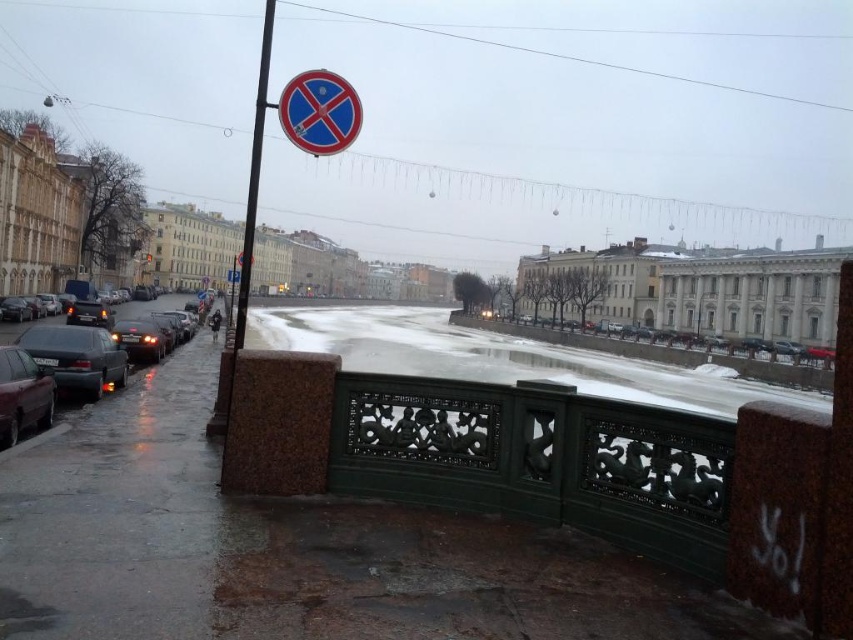
Based on the photo, you are a pedestrian standing on the bridge and want to take a photo of the matte black car at left and the polished metal pole at upper left. Which object should you focus on first to ensure both are in the frame?

The matte black car at left is closer to you than the polished metal pole at upper left, so focus on the matte black car at left first to ensure both are in the frame.

Looking at this image, you are a pedestrian standing on the bridge looking at the canal. You see a matte black car at left and a blue glossy circle at upper center. Which object is closer to the left edge of the bridge?

The matte black car at left is closer to the left edge of the bridge because it is positioned to the left of the blue glossy circle at upper center.